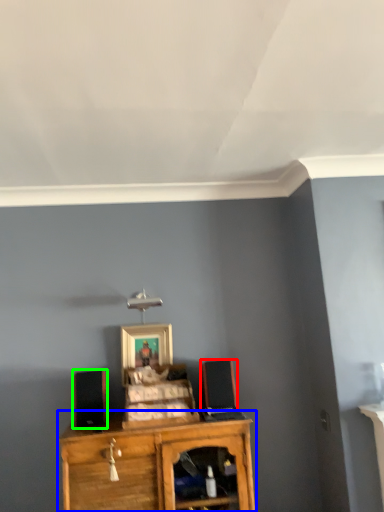
Question: Considering the real-world distances, which object is farthest from speaker (highlighted by a red box)? shelf (highlighted by a blue box) or speaker (highlighted by a green box)?

Choices:
 (A) shelf
 (B) speaker

Answer: (B)